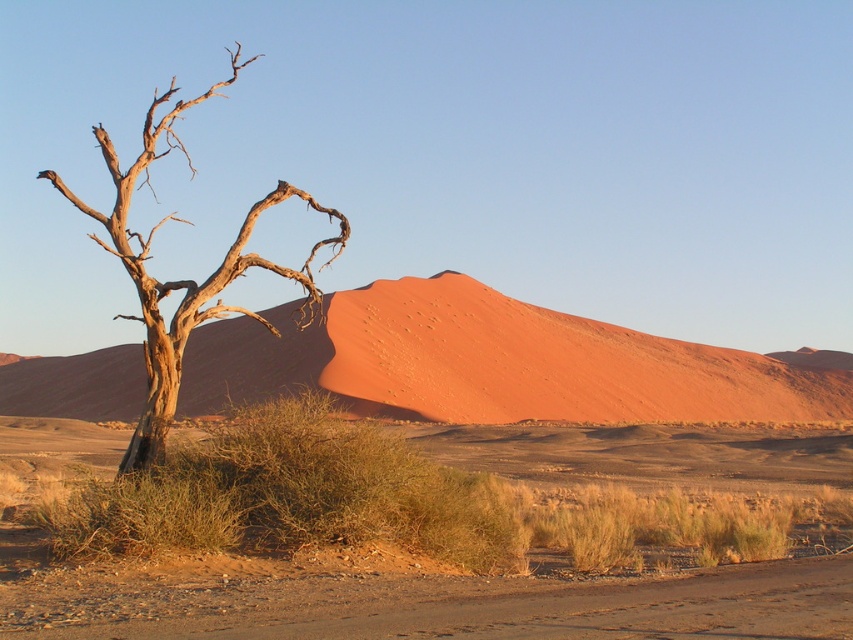
How distant is dusty gravel road at lower center from green shrub at center?

The distance of dusty gravel road at lower center from green shrub at center is 5.04 meters.

Does dusty gravel road at lower center appear over green shrub at center?

No, dusty gravel road at lower center is not above green shrub at center.

The image size is (853, 640). Describe the element at coordinates (440, 605) in the screenshot. I see `dusty gravel road at lower center` at that location.

Locate an element on the screen. The image size is (853, 640). dusty gravel road at lower center is located at coordinates (440, 605).

Does point (129, 358) lie behind point (181, 602)?

Yes, point (129, 358) is behind point (181, 602).

Does sandy orange dune at center appear over dusty gravel road at lower center?

Yes, sandy orange dune at center is above dusty gravel road at lower center.

Does point (431, 378) lie behind point (790, 618)?

Yes, it is.

The image size is (853, 640). I want to click on sandy orange dune at center, so click(494, 364).

What do you see at coordinates (494, 364) in the screenshot? Image resolution: width=853 pixels, height=640 pixels. I see `sandy orange dune at center` at bounding box center [494, 364].

Does sandy orange dune at center have a lesser width compared to dead brown wood at left?

Indeed, sandy orange dune at center has a lesser width compared to dead brown wood at left.

Who is more forward, (x=595, y=412) or (x=105, y=248)?

Point (x=105, y=248) is more forward.

Where is `sandy orange dune at center`? sandy orange dune at center is located at coordinates coord(494,364).